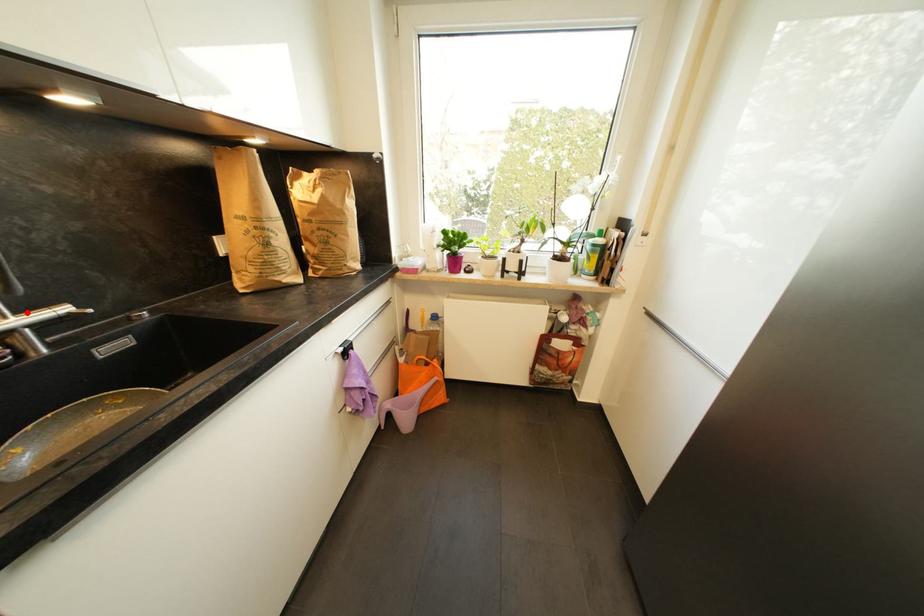
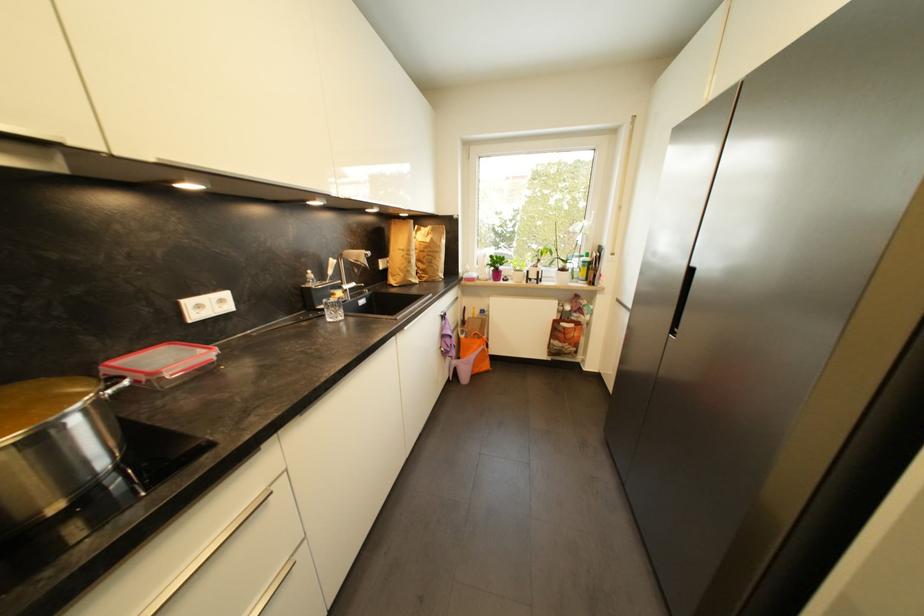
In the second image, find the point that corresponds to the highlighted location in the first image.

(353, 285)